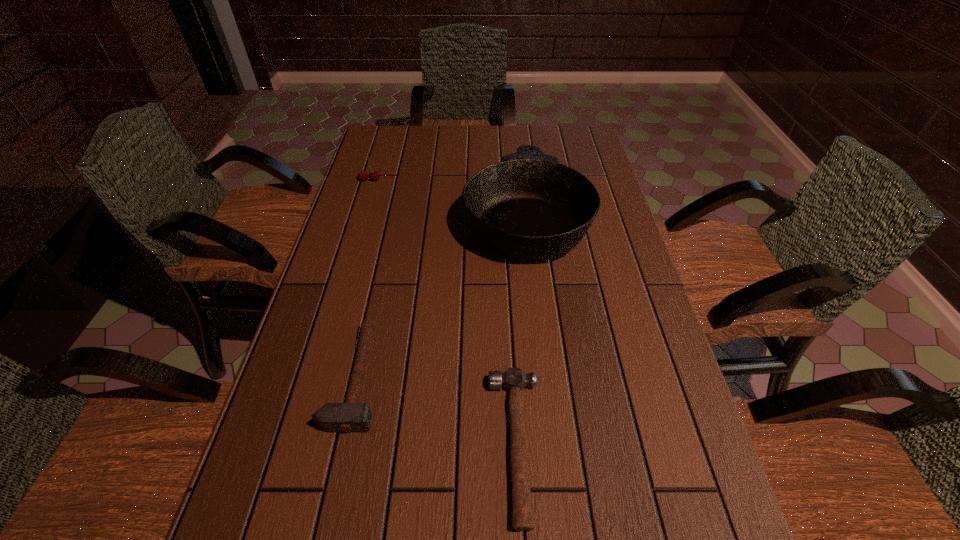
What are the coordinates of `frying pan` in the screenshot? It's located at (529, 206).

Where is `cherry`? The image size is (960, 540). cherry is located at coordinates (363, 175).

I want to click on the second tallest object, so click(x=363, y=175).

This screenshot has width=960, height=540. Identify the location of the left hammer. (350, 417).

At what (x,y) coordinates should I click in order to perform the action: click on the taller hammer. Please return your answer as a coordinate pair (x, y). The height and width of the screenshot is (540, 960). Looking at the image, I should click on (350, 417).

The height and width of the screenshot is (540, 960). What are the coordinates of `the right hammer` in the screenshot? It's located at (514, 379).

Locate an element on the screen. the shorter hammer is located at coordinates (514, 379).

Find the location of a particular element. Image resolution: width=960 pixels, height=540 pixels. vacant space located 0.300m with the handle extending from the side of the frying pan is located at coordinates (516, 126).

Where is `vacant space located with the handle extending from the side of the frying pan`? Image resolution: width=960 pixels, height=540 pixels. vacant space located with the handle extending from the side of the frying pan is located at coordinates (517, 142).

This screenshot has height=540, width=960. Identify the location of vacant space situated with the handle extending from the side of the frying pan. (518, 151).